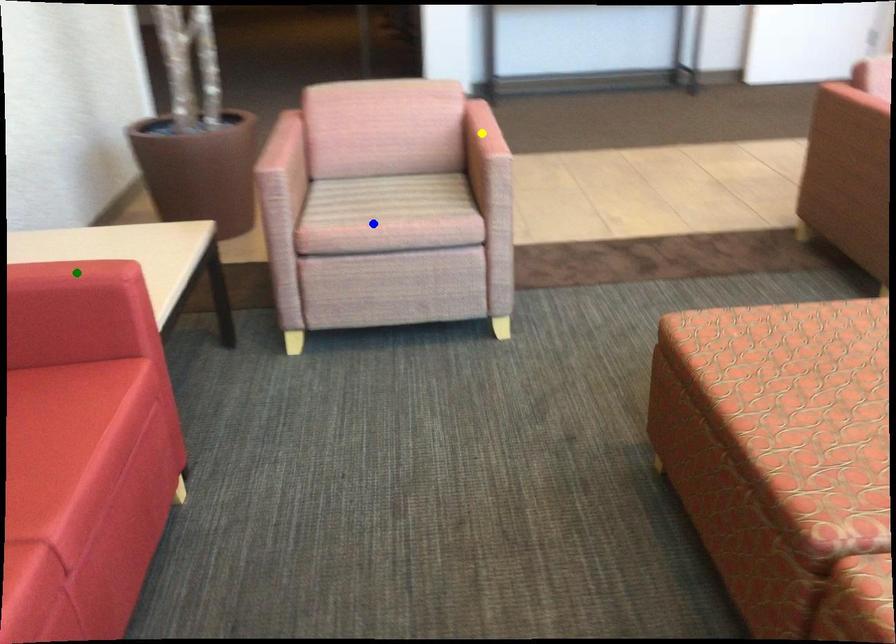
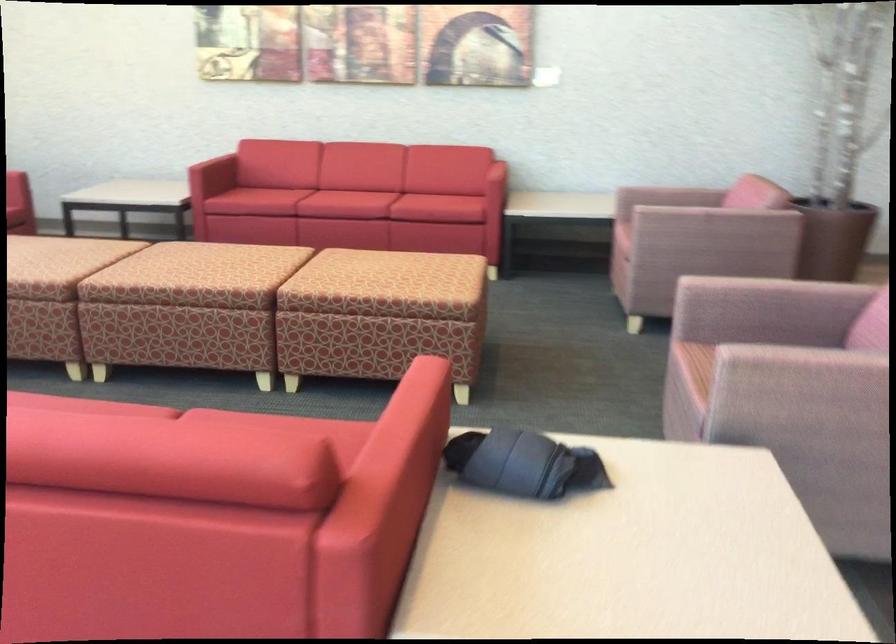
I am providing you with two images of the same scene from different viewpoints. Three points are marked in image1. Which point corresponds to a part or object that is occluded in image2?In image1, three points are marked. Which of them correspond to a part or object that is occluded in image2?Among the three points shown in image1, which one corresponds to a part or object that is no longer visible due to occlusion in image2?

Invisible in image2: yellow point, green point.